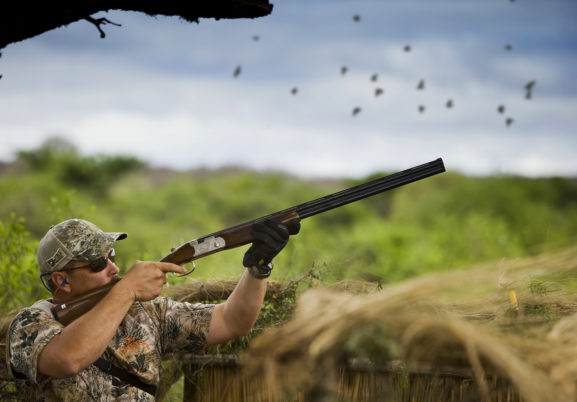
Locate an element on the screen. shades is located at coordinates (98, 263).